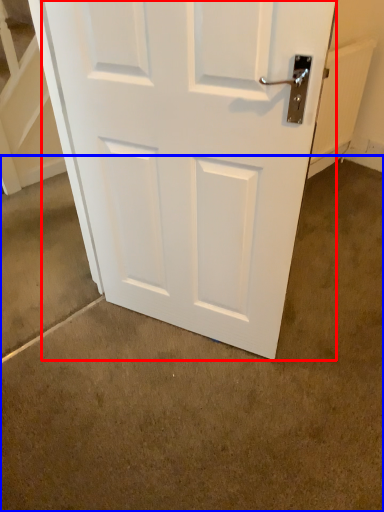
Question: Which object is closer to the camera taking this photo, door (highlighted by a red box) or concrete (highlighted by a blue box)?

Choices:
 (A) door
 (B) concrete

Answer: (B)